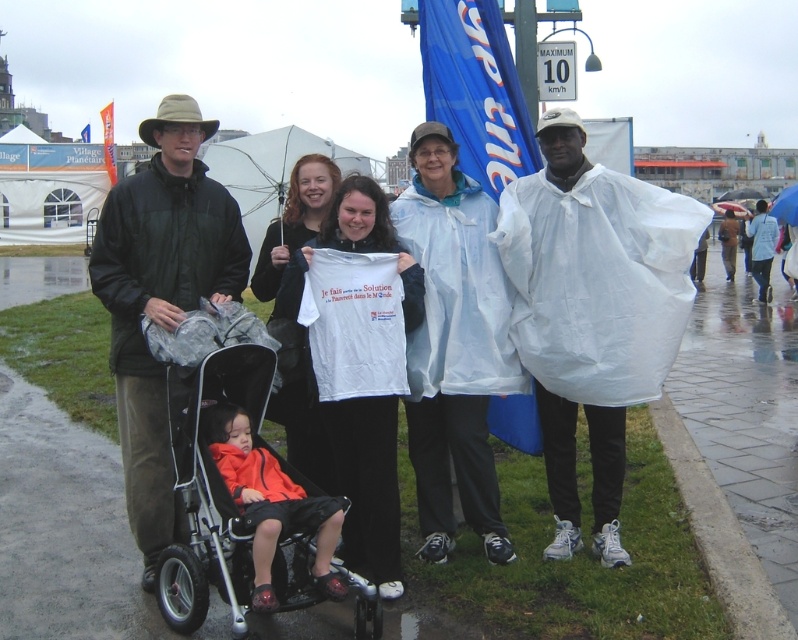
Which is below, white plastic poncho at center or white matte t-shirt at center?

Positioned lower is white plastic poncho at center.

Does point (508, 557) come closer to viewer compared to point (285, 243)?

Yes, it is.

You are a GUI agent. You are given a task and a screenshot of the screen. Output one action in this format:
    pyautogui.click(x=<x>, y=<y>)
    Task: Click on the white plastic poncho at center
    The image size is (798, 640).
    Given the screenshot: What is the action you would take?
    pyautogui.click(x=350, y=397)

In the scene shown: Between white plastic poncho at center and white fabric shirt at center, which one appears on the right side from the viewer's perspective?

white plastic poncho at center

Based on the photo, is white plastic poncho at center further to the viewer compared to white fabric shirt at center?

No.

Describe the element at coordinates (350, 397) in the screenshot. This screenshot has width=798, height=640. I see `white plastic poncho at center` at that location.

You are a GUI agent. You are given a task and a screenshot of the screen. Output one action in this format:
    pyautogui.click(x=<x>, y=<y>)
    Task: Click on the white plastic poncho at center
    This screenshot has height=640, width=798.
    Given the screenshot: What is the action you would take?
    pyautogui.click(x=350, y=397)

Can you confirm if white matte t-shirt at center is shorter than transparent plastic umbrella at upper center?

Indeed, white matte t-shirt at center has a lesser height compared to transparent plastic umbrella at upper center.

Between point (273, 291) and point (781, 202), which one is positioned in front?

Point (273, 291)

Where is `white matte t-shirt at center`? This screenshot has height=640, width=798. white matte t-shirt at center is located at coordinates (295, 220).

What are the coordinates of `white matte t-shirt at center` in the screenshot? It's located at (295, 220).